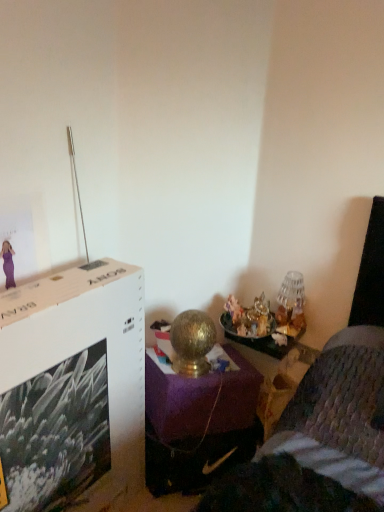
At what (x,y) coordinates should I click in order to perform the action: click on vacant point above white cardboard file cabinet at upper left (from a real-world perspective). Please return your answer as a coordinate pair (x, y). The width and height of the screenshot is (384, 512). Looking at the image, I should click on (57, 288).